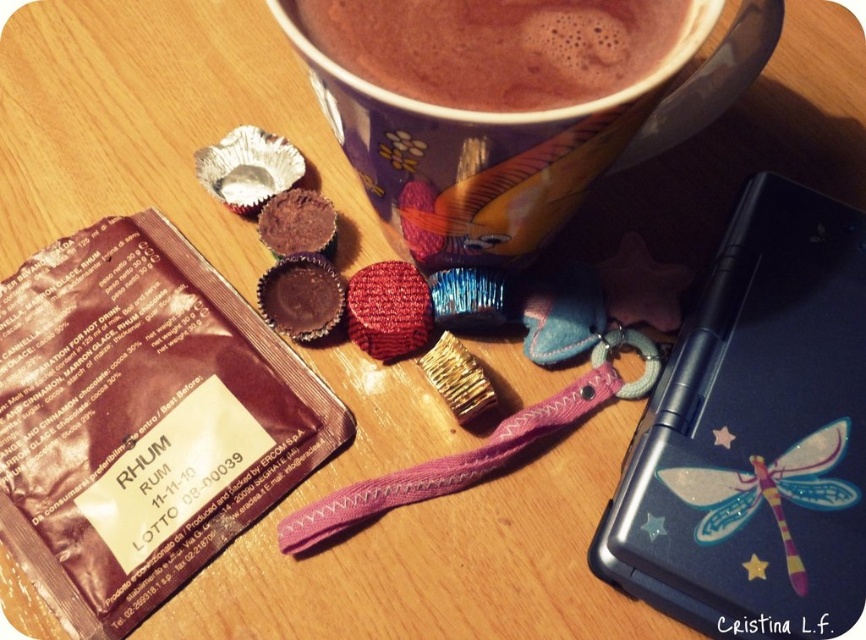
You are a child who wants to play with the translucent plastic dragonfly at upper right and the brown shiny chocolate bar at lower left. Which object can you pick up first without moving the other one?

The translucent plastic dragonfly at upper right can be picked up first without moving the brown shiny chocolate bar at lower left because it is smaller and likely requires less space to maneuver around.

You are a customer at a coffee shop and you see two points on the table where you can place your phone. The points are at coordinates point (224, 468) and point (451, 211). Which point is closer to you so you can easily reach your phone?

Point (224, 468) is closer to you than point (451, 211), so you can easily reach your phone placed there.